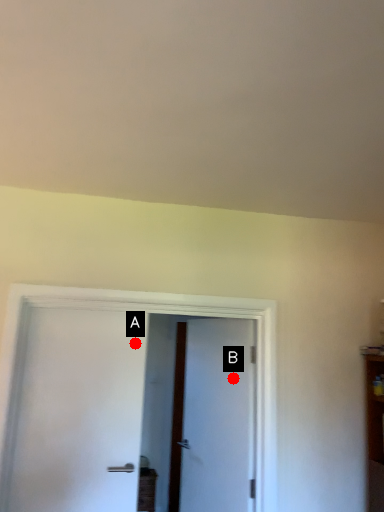
Question: Two points are circled on the image, labeled by A and B beside each circle. Among these points, which one is farthest from the camera?

Choices:
 (A) A is further
 (B) B is further

Answer: (B)